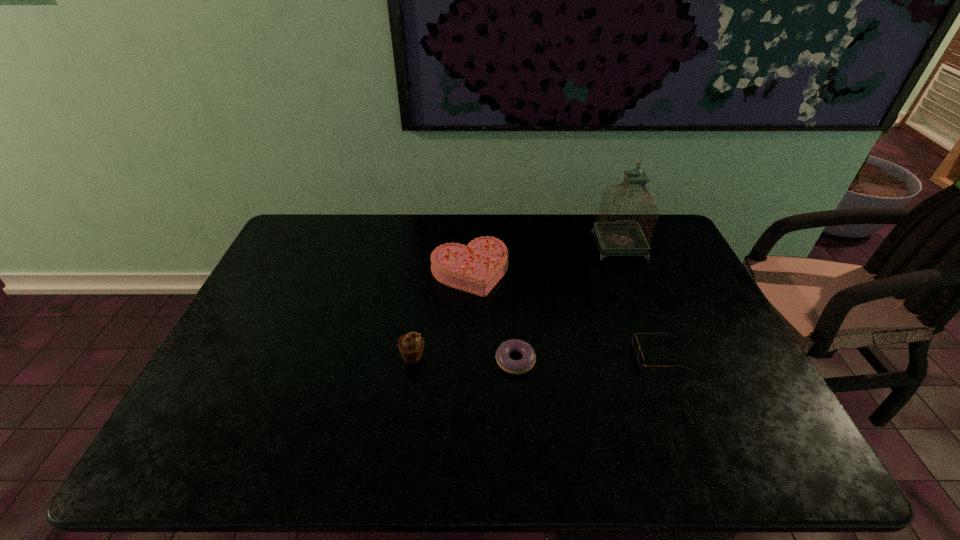
The height and width of the screenshot is (540, 960). I want to click on free space between the doughnut and the cake, so click(x=492, y=316).

Identify the location of unoccupied area between the muffin and the birdcage. This screenshot has width=960, height=540. (516, 301).

Choose which object is the nearest neighbor to the second tallest object. Please provide its 2D coordinates. Your answer should be formatted as a tuple, i.e. [(x, y)], where the tuple contains the x and y coordinates of a point satisfying the conditions above.

[(526, 363)]

Locate which object is the third closest to the doughnut. Please provide its 2D coordinates. Your answer should be formatted as a tuple, i.e. [(x, y)], where the tuple contains the x and y coordinates of a point satisfying the conditions above.

[(635, 343)]